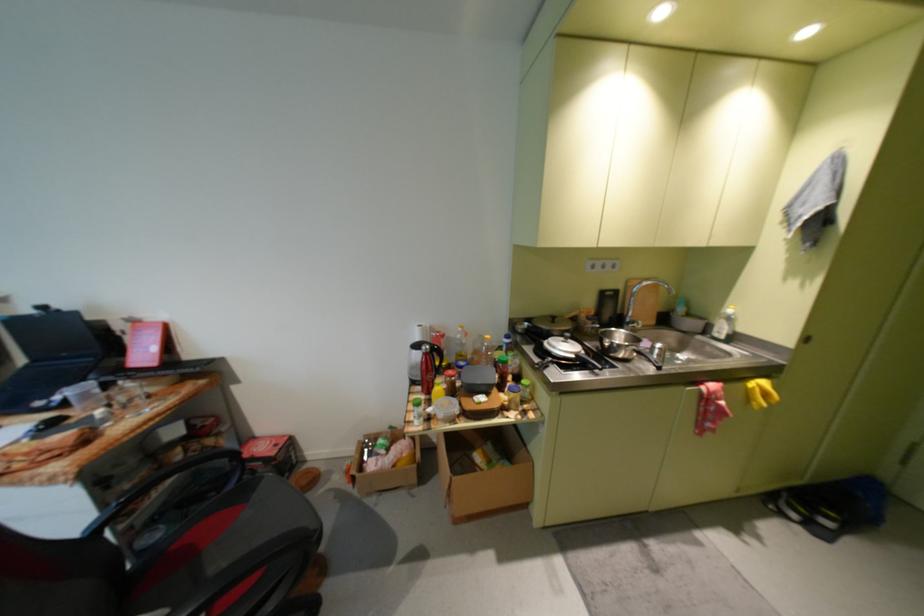
Image resolution: width=924 pixels, height=616 pixels. What do you see at coordinates (444, 408) in the screenshot?
I see `a white pot lid` at bounding box center [444, 408].